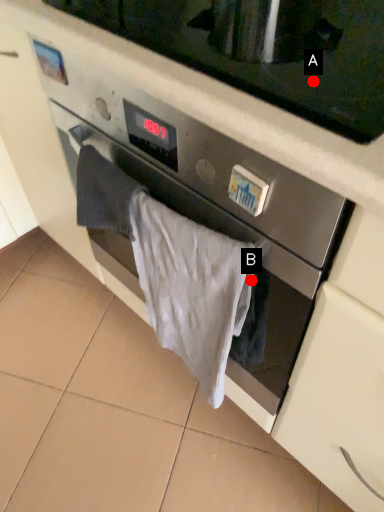
Question: Two points are circled on the image, labeled by A and B beside each circle. Among these points, which one is nearest to the camera?

Choices:
 (A) A is closer
 (B) B is closer

Answer: (B)